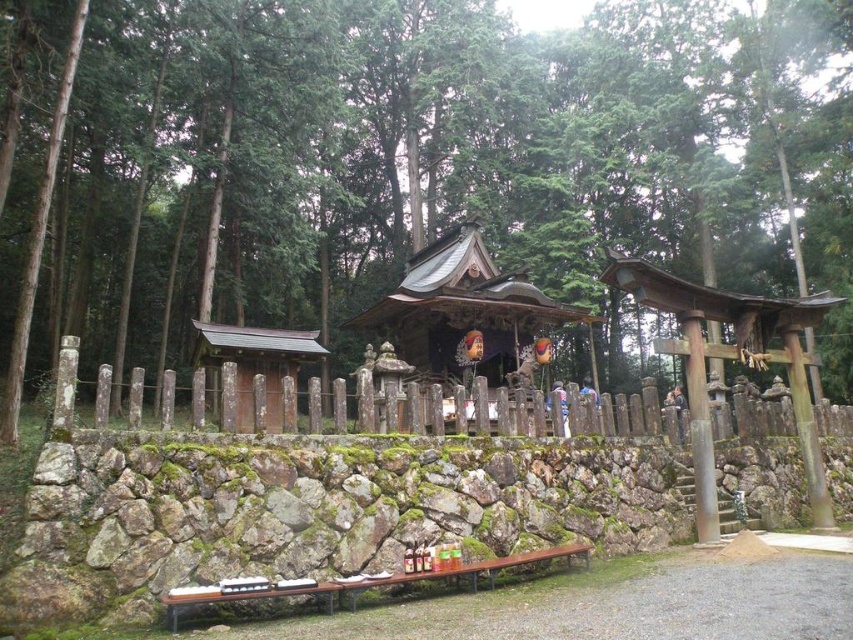
Question: Which point appears farthest from the camera in this image?

Choices:
 (A) 322,349
 (B) 492,269

Answer: (B)

Question: Can you confirm if green mossy stone wall at center is wider than weathered wood fence at center?

Choices:
 (A) no
 (B) yes

Answer: (B)

Question: Which of the following is the closest to the observer?

Choices:
 (A) (68, 180)
 (B) (242, 340)
 (C) (480, 428)

Answer: (C)

Question: Does green mossy stone wall at center lie behind wooden shrine at center?

Choices:
 (A) yes
 (B) no

Answer: (B)

Question: Is wooden shrine at center positioned in front of smooth wooden hut at left?

Choices:
 (A) yes
 (B) no

Answer: (B)

Question: Which point is farther to the camera?

Choices:
 (A) (509, 285)
 (B) (167, 122)

Answer: (B)